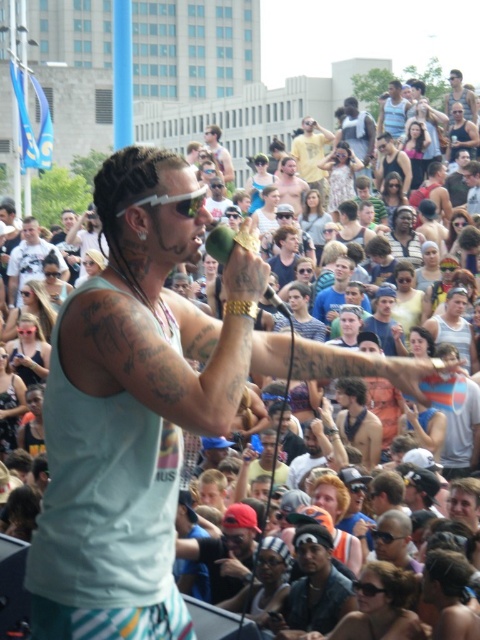
Question: Among these objects, which one is farthest from the camera?

Choices:
 (A) light blue tank top at center
 (B) green matte microphone at center
 (C) matte black phone at center
 (D) yellow cotton shirt at upper center

Answer: (D)

Question: Which object appears farthest from the camera in this image?

Choices:
 (A) black leather cap at center
 (B) matte black phone at center
 (C) green matte microphone at center
 (D) matte black tank top at center

Answer: (D)

Question: Which object appears closest to the camera in this image?

Choices:
 (A) yellow cotton shirt at upper center
 (B) green matte microphone at center
 (C) matte black tank top at center
 (D) matte black phone at center

Answer: (B)

Question: Considering the relative positions of light blue tank top at center and black leather cap at center in the image provided, where is light blue tank top at center located with respect to black leather cap at center?

Choices:
 (A) above
 (B) below

Answer: (A)

Question: Is light blue tank top at center below black leather cap at center?

Choices:
 (A) yes
 (B) no

Answer: (B)

Question: Does light blue tank top at center have a smaller size compared to matte black phone at center?

Choices:
 (A) yes
 (B) no

Answer: (B)